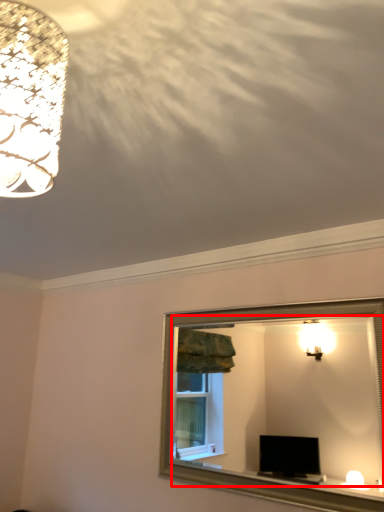
Question: In this image, where is mirror (annotated by the red box) located relative to lamp?

Choices:
 (A) left
 (B) right

Answer: (B)